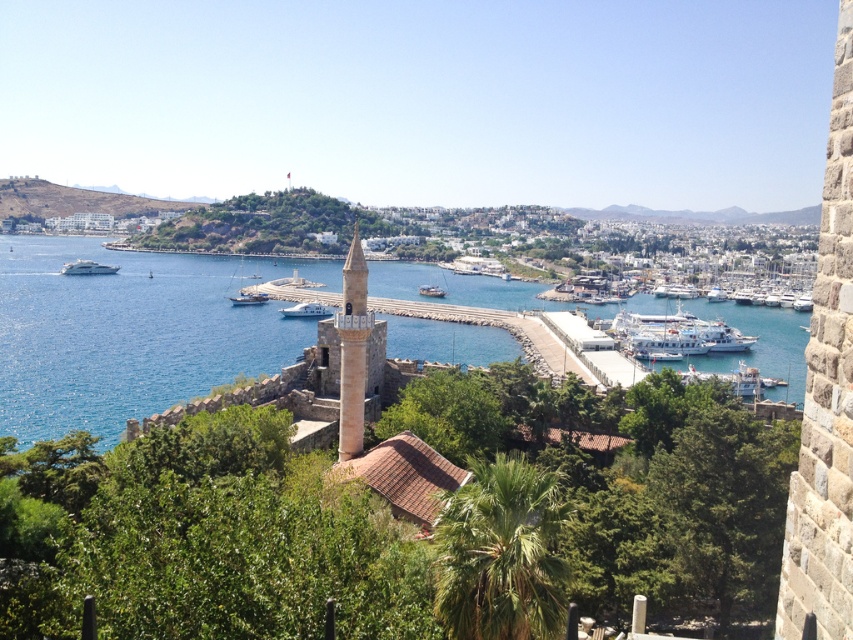
You are standing at the point marked as point [306,310] in the image. What object are you standing on?

You are standing on the white glossy boat at center.

You are a tour guide explaining the harbor to visitors. You mention both the white glossy boat at center and the wooden sailboat at center. How far apart are these two boats from each other?

The white glossy boat at center and the wooden sailboat at center are 74.59 meters apart.

You are standing at the top of the hill overlooking the harbor and see the light brown stone tower at center and the white glossy yacht at left. Which object is nearer to you?

The light brown stone tower at center is closer to the viewer than the white glossy yacht at left.